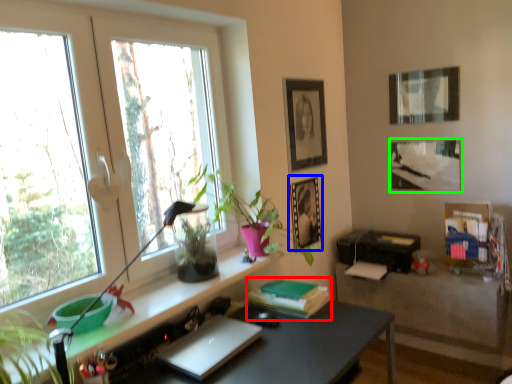
Question: Based on their relative distances, which object is nearer to book (highlighted by a red box)? Choose from picture frame (highlighted by a blue box) and picture frame (highlighted by a green box).

Choices:
 (A) picture frame
 (B) picture frame

Answer: (A)